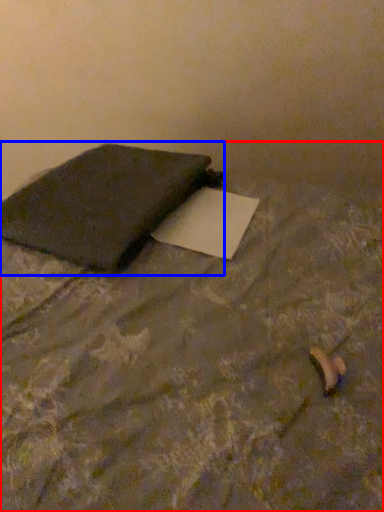
Question: Which object appears farthest to the camera in this image, furniture (highlighted by a red box) or notebook (highlighted by a blue box)?

Choices:
 (A) furniture
 (B) notebook

Answer: (B)